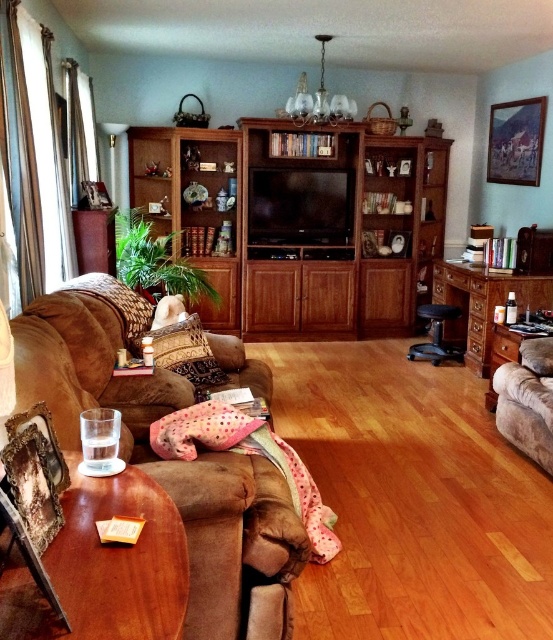
You are sitting in the suede armchair at right and want to reach the remote control placed on the wooden entertainment center at center. Which direction should you move to get it?

The wooden entertainment center at center is positioned on the left side of the suede armchair at right, so you should move to your left to reach the remote control.

You are a delivery person carrying a large package that measures 3 meters in length. You need to navigate through the living room to place the package between the wooden entertainment center at center and the suede armchair at right. Is there enough space for the package to fit between these two objects?

The distance between the wooden entertainment center at center and the suede armchair at right is 2.81 meters. Since the package is 3 meters long, it is slightly longer than the available space. Therefore, the package cannot fit between them.

You are a guest entering the living room and want to sit down. You notice the suede couch at left and the suede armchair at right. Which one has a higher seating position?

The suede couch at left has a higher seating position than the suede armchair at right.